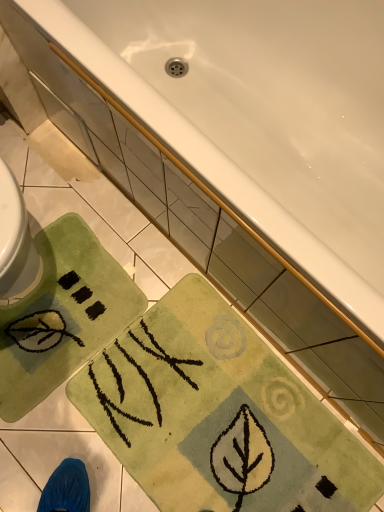
Locate an element on the screen. The height and width of the screenshot is (512, 384). free location above green soft rug at lower center, the 1th beach towel viewed from the right (from a real-world perspective) is located at coordinates (224, 422).